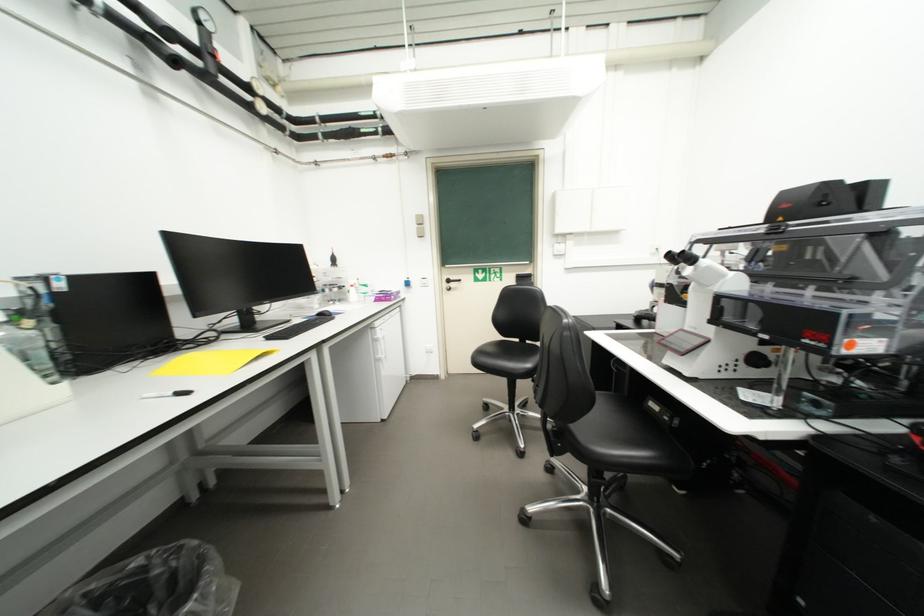
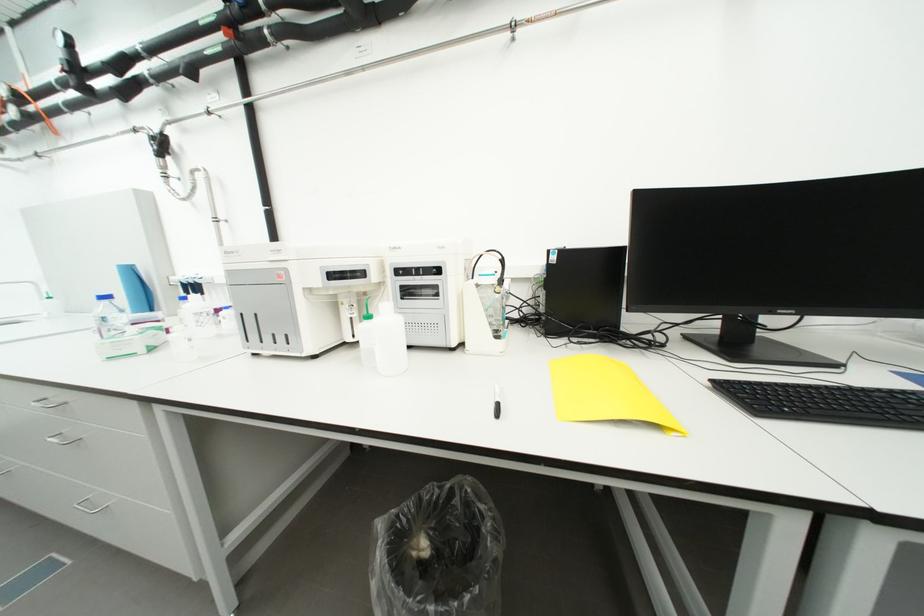
Where in the second image is the point corresponding to pixel 68 286 from the first image?

(562, 259)